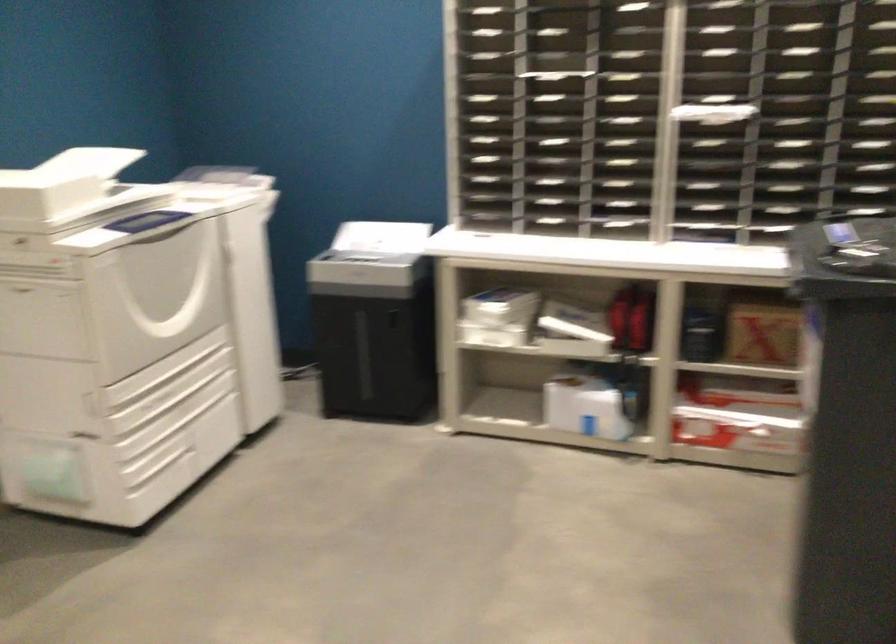
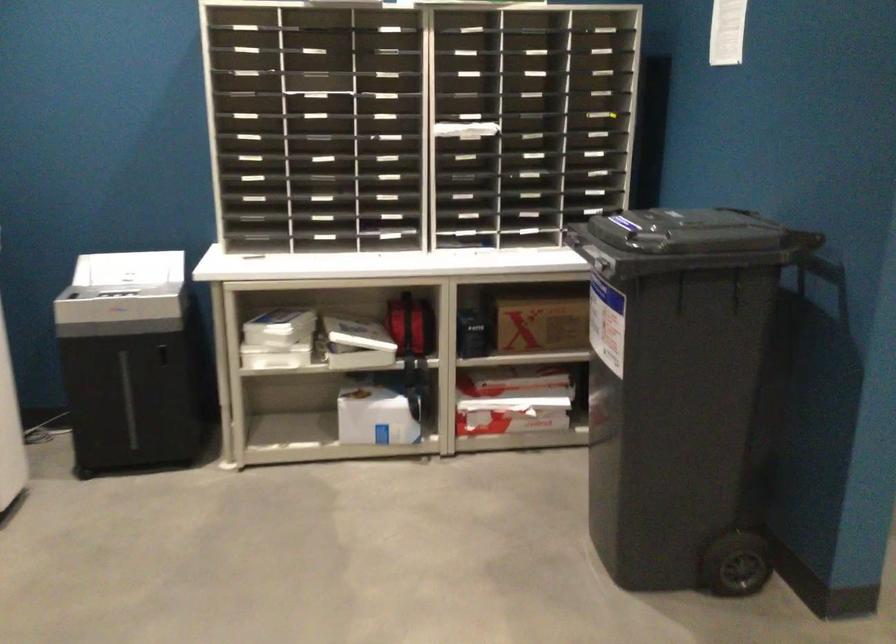
Question: The first image is from the beginning of the video and the second image is from the end. How did the camera likely rotate when shooting the video?

Choices:
 (A) Left
 (B) Right
 (C) Up
 (D) Down

Answer: (B)